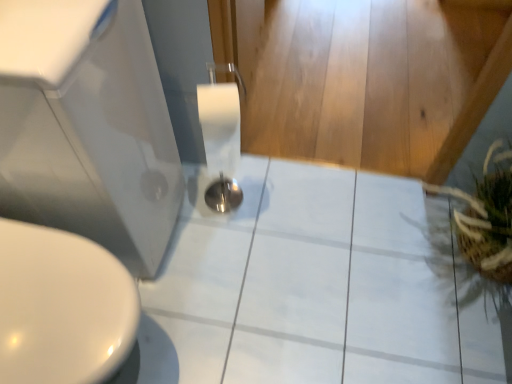
Question: From a real-world perspective, does white glossy tile at center sit lower than white glossy sink at lower left?

Choices:
 (A) no
 (B) yes

Answer: (B)

Question: Does white glossy tile at center turn towards white glossy sink at lower left?

Choices:
 (A) yes
 (B) no

Answer: (B)

Question: From the image's perspective, would you say white glossy tile at center is positioned over white glossy sink at lower left?

Choices:
 (A) no
 (B) yes

Answer: (A)

Question: Is white glossy tile at center at the left side of white glossy sink at lower left?

Choices:
 (A) no
 (B) yes

Answer: (A)

Question: Does white glossy tile at center appear on the right side of white glossy sink at lower left?

Choices:
 (A) no
 (B) yes

Answer: (B)

Question: In the image, is brown woven basket at right positioned in front of or behind white glossy sink at lower left?

Choices:
 (A) front
 (B) behind

Answer: (B)

Question: Considering the positions of brown woven basket at right and white glossy sink at lower left in the image, is brown woven basket at right taller or shorter than white glossy sink at lower left?

Choices:
 (A) tall
 (B) short

Answer: (B)

Question: Would you say brown woven basket at right is to the left or to the right of white glossy sink at lower left in the picture?

Choices:
 (A) left
 (B) right

Answer: (B)

Question: Is point (508, 172) positioned closer to the camera than point (101, 26)?

Choices:
 (A) farther
 (B) closer

Answer: (A)

Question: Is white glossy sink at lower left taller or shorter than brown woven basket at right?

Choices:
 (A) short
 (B) tall

Answer: (B)

Question: From a real-world perspective, is white glossy sink at lower left above or below brown woven basket at right?

Choices:
 (A) above
 (B) below

Answer: (A)

Question: Looking at the image, does white glossy sink at lower left seem bigger or smaller compared to brown woven basket at right?

Choices:
 (A) small
 (B) big

Answer: (B)

Question: Considering the relative positions of white glossy sink at lower left and brown woven basket at right in the image provided, is white glossy sink at lower left to the left or to the right of brown woven basket at right?

Choices:
 (A) left
 (B) right

Answer: (A)

Question: Considering their positions, is brown woven basket at right located in front of or behind white glossy tile at center?

Choices:
 (A) behind
 (B) front

Answer: (B)

Question: From a real-world perspective, relative to white glossy tile at center, is brown woven basket at right vertically above or below?

Choices:
 (A) above
 (B) below

Answer: (A)